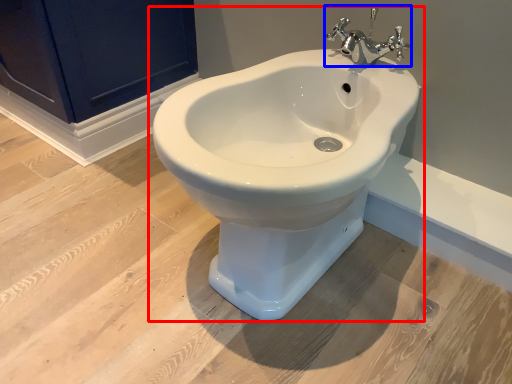
Question: Which point is closer to the camera, toilet (highlighted by a red box) or tap (highlighted by a blue box)?

Choices:
 (A) toilet
 (B) tap

Answer: (A)